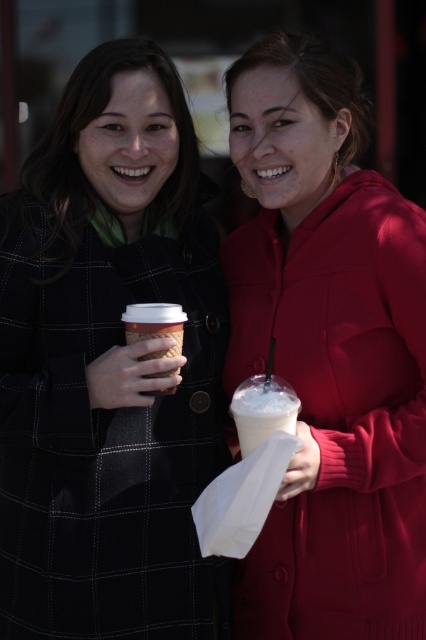
Question: Does white frothy drink at center have a lesser width compared to white paper cup at center?

Choices:
 (A) yes
 (B) no

Answer: (B)

Question: In this image, where is matte black coat at left located relative to white frothy drink at center?

Choices:
 (A) above
 (B) below

Answer: (A)

Question: Which is nearer to the white paper cup at center?

Choices:
 (A) matte black coat at left
 (B) white frothy drink at center
 (C) matte red hoodie at right

Answer: (B)

Question: Is matte black coat at left wider than white paper cup at center?

Choices:
 (A) yes
 (B) no

Answer: (A)

Question: Which is nearer to the matte red hoodie at right?

Choices:
 (A) matte black coat at left
 (B) white paper cup at center

Answer: (A)

Question: Considering the real-world distances, which object is farthest from the white frothy drink at center?

Choices:
 (A) matte red hoodie at right
 (B) white paper cup at center
 (C) matte black coat at left

Answer: (C)